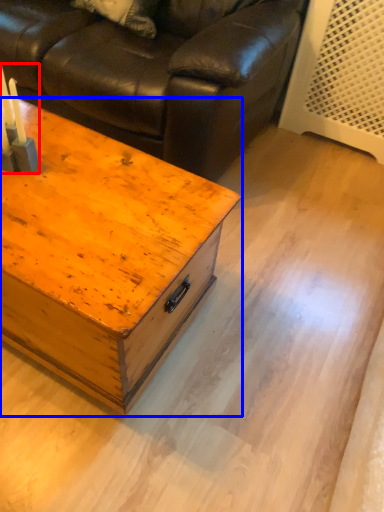
Question: Which object appears farthest to the camera in this image, candle holder (highlighted by a red box) or table (highlighted by a blue box)?

Choices:
 (A) candle holder
 (B) table

Answer: (A)